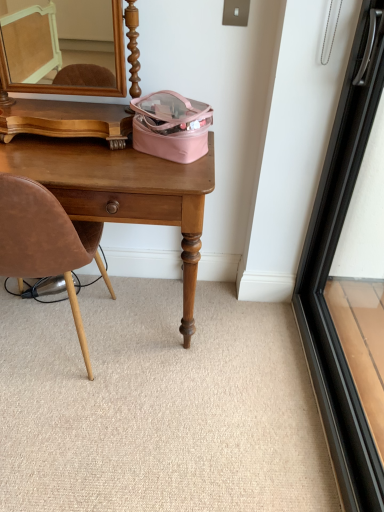
The height and width of the screenshot is (512, 384). Identify the location of vacant region under wooden desk at center (from a real-world perspective). (143, 306).